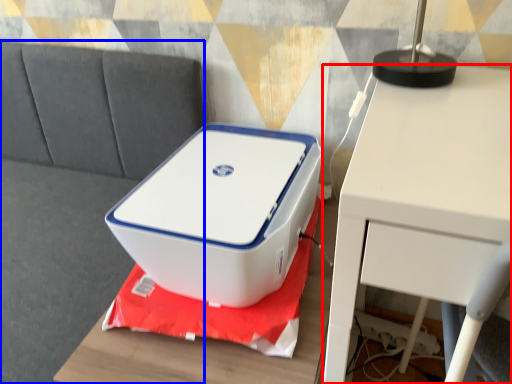
Question: Which object is closer to the camera taking this photo, table (highlighted by a red box) or couch (highlighted by a blue box)?

Choices:
 (A) table
 (B) couch

Answer: (A)